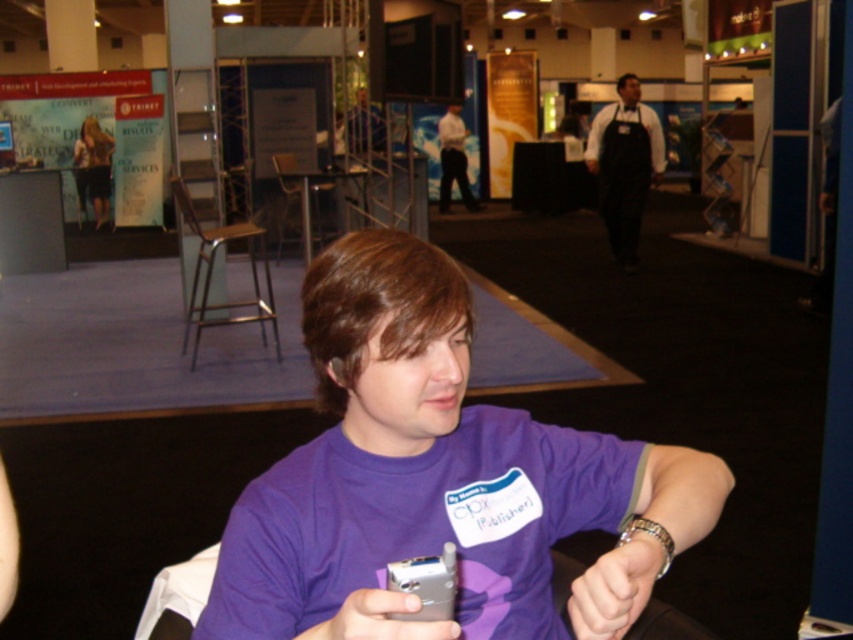
Is point (627, 221) less distant than point (96, 204)?

That is True.

Can you confirm if black apron at right is positioned below matte black dress at upper left?

Correct, black apron at right is located below matte black dress at upper left.

Who is more distant from viewer, (618, 120) or (80, 188)?

Point (80, 188)

This screenshot has width=853, height=640. What are the coordinates of `black apron at right` in the screenshot? It's located at (624, 164).

Can you confirm if purple fabric shirt at center is bigger than purple fabric wristband at lower center?

Correct, purple fabric shirt at center is larger in size than purple fabric wristband at lower center.

Who is more distant from viewer, (244, 602) or (643, 582)?

Positioned behind is point (244, 602).

Where is `purple fabric shirt at center`? The height and width of the screenshot is (640, 853). purple fabric shirt at center is located at coordinates (428, 474).

What do you see at coordinates (93, 168) in the screenshot? I see `matte black dress at upper left` at bounding box center [93, 168].

Can you confirm if matte black dress at upper left is positioned to the right of white shirt at center?

Incorrect, matte black dress at upper left is not on the right side of white shirt at center.

What do you see at coordinates (93, 168) in the screenshot?
I see `matte black dress at upper left` at bounding box center [93, 168].

Where is `matte black dress at upper left`? Image resolution: width=853 pixels, height=640 pixels. matte black dress at upper left is located at coordinates (93, 168).